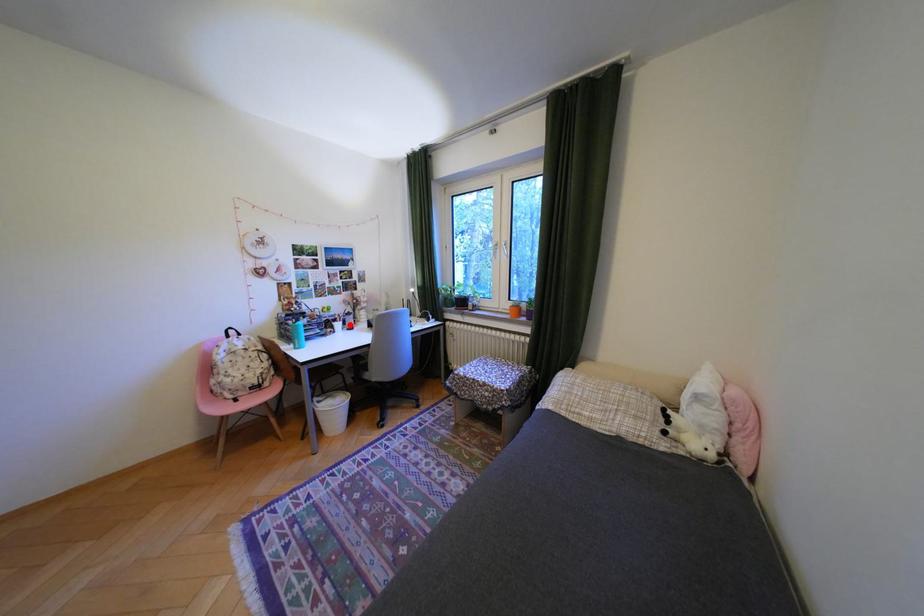
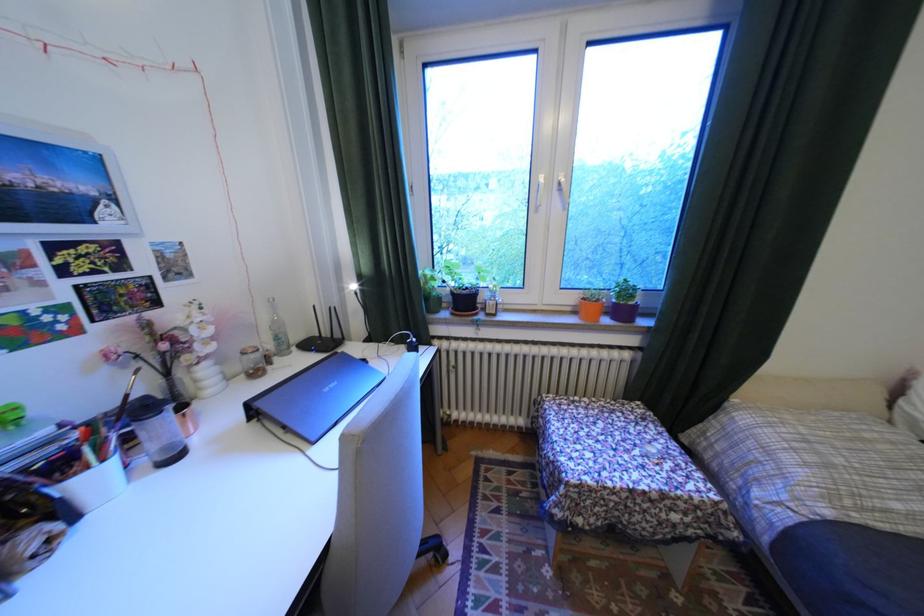
Find the pixel in the second image that matches the highlighted location in the first image.

(106, 479)